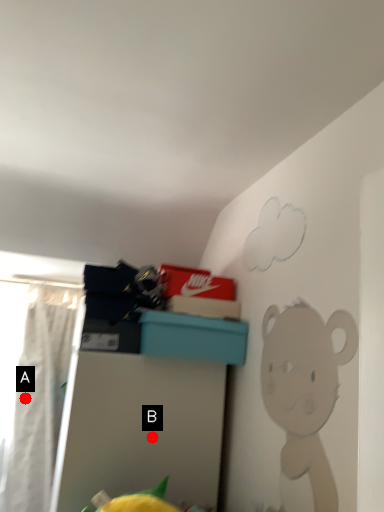
Question: Two points are circled on the image, labeled by A and B beside each circle. Among these points, which one is farthest from the camera?

Choices:
 (A) A is further
 (B) B is further

Answer: (A)